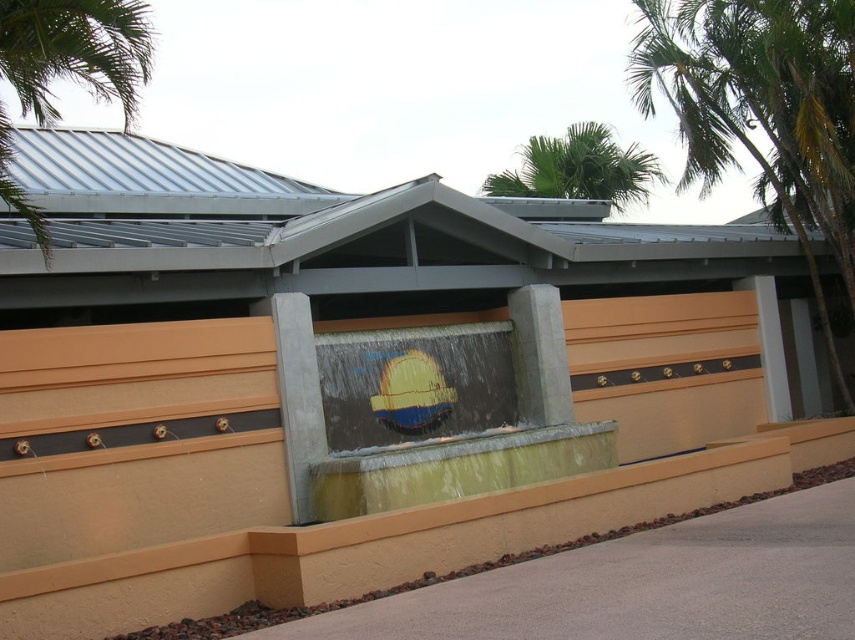
Question: Is clear glass water at center smaller than concrete at center?

Choices:
 (A) no
 (B) yes

Answer: (A)

Question: Which point appears closest to the camera in this image?

Choices:
 (A) (836, 211)
 (B) (384, 500)
 (C) (626, 188)
 (D) (529, 342)

Answer: (B)

Question: Which of the following is the farthest from the observer?

Choices:
 (A) green leafy palm tree at upper center
 (B) smooth concrete fountain at center
 (C) clear glass water at center

Answer: (A)

Question: Observing the image, what is the correct spatial positioning of smooth concrete fountain at center in reference to green leafy palm tree at upper left?

Choices:
 (A) left
 (B) right

Answer: (B)

Question: Does green leafy palm tree at upper left have a smaller size compared to green leafy palm tree at upper center?

Choices:
 (A) yes
 (B) no

Answer: (A)

Question: Which of the following is the farthest from the observer?

Choices:
 (A) (612, 426)
 (B) (659, 77)
 (C) (558, 321)
 (D) (38, 33)

Answer: (B)